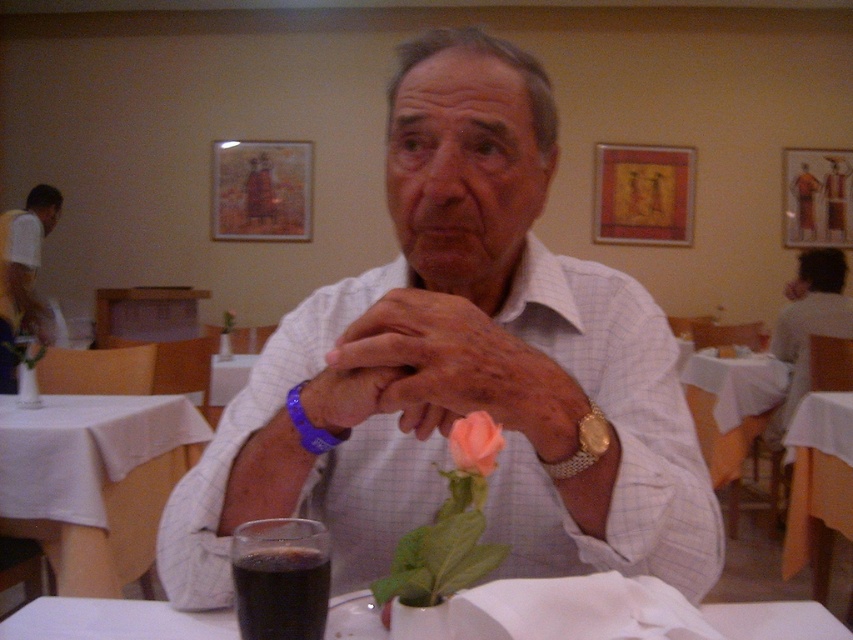
Question: Considering the real-world distances, which object is farthest from the white checkered shirt at center?

Choices:
 (A) white glossy table at lower center
 (B) white cloth at lower left

Answer: (B)

Question: Which point is farther to the camera?

Choices:
 (A) (734, 609)
 (B) (3, 314)

Answer: (B)

Question: Does dark liquid glass at center appear over matte white shirt at center?

Choices:
 (A) no
 (B) yes

Answer: (A)

Question: Considering the real-world distances, which object is farthest from the blue rubber bracelet at center?

Choices:
 (A) leather wristwatch at center
 (B) pink matte rose at center
 (C) white fabric shirt at left

Answer: (C)

Question: Is matte white shirt at center closer to camera compared to pink matte rose at center?

Choices:
 (A) yes
 (B) no

Answer: (B)

Question: Does white checkered shirt at center lie behind gold mesh watch at center?

Choices:
 (A) yes
 (B) no

Answer: (B)